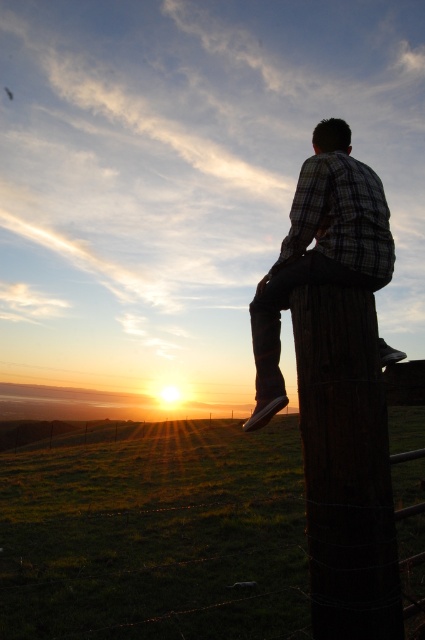
Question: Which is nearer to the plaid shirt at center?

Choices:
 (A) dark brown wooden post at right
 (B) wooden post at center

Answer: (A)

Question: In this image, where is wooden post at center located relative to dark brown wooden post at right?

Choices:
 (A) below
 (B) above

Answer: (A)

Question: Which object is the farthest from the dark brown wooden post at right?

Choices:
 (A) wooden post at center
 (B) plaid shirt at center

Answer: (A)

Question: Which point appears closest to the camera in this image?

Choices:
 (A) (144, 522)
 (B) (371, 604)
 (C) (291, 227)

Answer: (B)

Question: Is dark brown wooden post at right wider than plaid shirt at center?

Choices:
 (A) yes
 (B) no

Answer: (A)

Question: Is wooden post at center below dark brown wooden post at right?

Choices:
 (A) no
 (B) yes

Answer: (B)